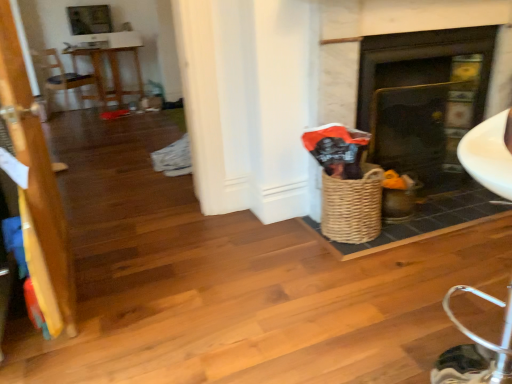
Question: From a real-world perspective, is wooden armchair at left above or below woven brown basket at right?

Choices:
 (A) above
 (B) below

Answer: (A)

Question: From the image's perspective, is wooden armchair at left positioned above or below woven brown basket at right?

Choices:
 (A) below
 (B) above

Answer: (B)

Question: Which of these objects is positioned closest to the wooden armchair at left?

Choices:
 (A) wooden door at left
 (B) wooden table at upper left
 (C) woven brown basket at right
 (D) matte black fireplace at center

Answer: (B)

Question: Considering the real-world distances, which object is farthest from the wooden table at upper left?

Choices:
 (A) wooden door at left
 (B) matte black fireplace at center
 (C) wooden armchair at left
 (D) woven brown basket at right

Answer: (D)